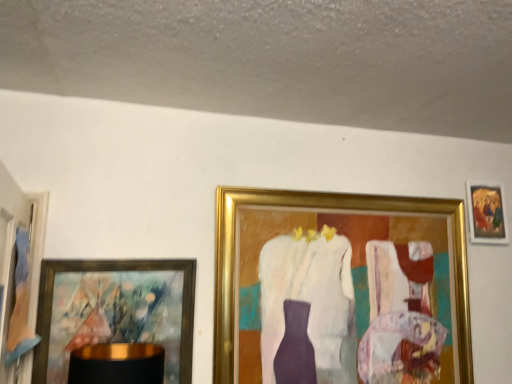
Question: Is gold-framed painting at upper right, which appears as the 4th picture frame when viewed from the left, further to the viewer compared to gold-framed painting at left, positioned as the second picture frame in left-to-right order?

Choices:
 (A) yes
 (B) no

Answer: (A)

Question: Is gold-framed painting at upper right, placed as the first picture frame when sorted from right to left, not near gold-framed painting at left, positioned as the second picture frame in left-to-right order?

Choices:
 (A) no
 (B) yes

Answer: (B)

Question: Is gold-framed painting at upper right, which appears as the 4th picture frame when viewed from the left, not inside gold-framed painting at left, which ranks as the third picture frame in right-to-left order?

Choices:
 (A) no
 (B) yes

Answer: (B)

Question: Is gold-framed painting at left, which ranks as the third picture frame in right-to-left order, inside gold-framed painting at upper right, placed as the first picture frame when sorted from right to left?

Choices:
 (A) yes
 (B) no

Answer: (B)

Question: From a real-world perspective, is gold-framed painting at upper right, placed as the first picture frame when sorted from right to left, on gold-framed painting at left, positioned as the second picture frame in left-to-right order?

Choices:
 (A) no
 (B) yes

Answer: (B)

Question: Would you say gold metallic picture frame at center, the second picture frame viewed from the right, is inside or outside wooden picture frame at left, positioned as the first picture frame in left-to-right order?

Choices:
 (A) inside
 (B) outside

Answer: (B)

Question: Considering the relative positions of gold metallic picture frame at center, marked as the third picture frame in a left-to-right arrangement, and wooden picture frame at left, which is the 4th picture frame in right-to-left order, in the image provided, is gold metallic picture frame at center, marked as the third picture frame in a left-to-right arrangement, to the left or to the right of wooden picture frame at left, which is the 4th picture frame in right-to-left order,?

Choices:
 (A) left
 (B) right

Answer: (B)

Question: From the image's perspective, is gold metallic picture frame at center, the second picture frame viewed from the right, positioned above or below wooden picture frame at left, which is the 4th picture frame in right-to-left order?

Choices:
 (A) below
 (B) above

Answer: (A)

Question: Is point (452, 221) closer or farther from the camera than point (26, 377)?

Choices:
 (A) farther
 (B) closer

Answer: (A)

Question: Does point (134, 296) appear closer or farther from the camera than point (485, 188)?

Choices:
 (A) closer
 (B) farther

Answer: (A)

Question: Relative to gold-framed painting at upper right, placed as the first picture frame when sorted from right to left, is gold-framed painting at left, which ranks as the third picture frame in right-to-left order, in front or behind?

Choices:
 (A) front
 (B) behind

Answer: (A)

Question: Looking at their shapes, would you say gold-framed painting at left, which ranks as the third picture frame in right-to-left order, is wider or thinner than gold-framed painting at upper right, placed as the first picture frame when sorted from right to left?

Choices:
 (A) thin
 (B) wide

Answer: (B)

Question: From a real-world perspective, is gold-framed painting at left, positioned as the second picture frame in left-to-right order, above or below gold-framed painting at upper right, which appears as the 4th picture frame when viewed from the left?

Choices:
 (A) below
 (B) above

Answer: (A)

Question: Is wooden picture frame at left, which is the 4th picture frame in right-to-left order, to the left or to the right of gold-framed painting at left, which ranks as the third picture frame in right-to-left order, in the image?

Choices:
 (A) right
 (B) left

Answer: (B)

Question: Considering their positions, is wooden picture frame at left, positioned as the first picture frame in left-to-right order, located in front of or behind gold-framed painting at left, positioned as the second picture frame in left-to-right order?

Choices:
 (A) front
 (B) behind

Answer: (A)